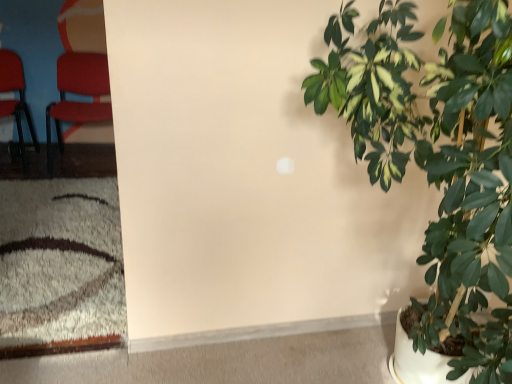
Question: From a real-world perspective, is green glossy leafy plant at right above or below matte red chair at left, the first chair when ordered from right to left?

Choices:
 (A) below
 (B) above

Answer: (B)

Question: Does point (509, 200) appear closer or farther from the camera than point (73, 129)?

Choices:
 (A) closer
 (B) farther

Answer: (A)

Question: Estimate the real-world distances between objects in this image. Which object is farther from the matte red chair at left, which ranks as the first chair in left-to-right order?

Choices:
 (A) white matte carpet at lower left
 (B) green glossy leafy plant at right
 (C) matte red chair at left, the first chair when ordered from right to left

Answer: (B)

Question: Estimate the real-world distances between objects in this image. Which object is farther from the white matte carpet at lower left?

Choices:
 (A) matte red chair at left, the 2th chair from the left
 (B) matte red chair at left, marked as the 2th chair in a right-to-left arrangement
 (C) green glossy leafy plant at right

Answer: (B)